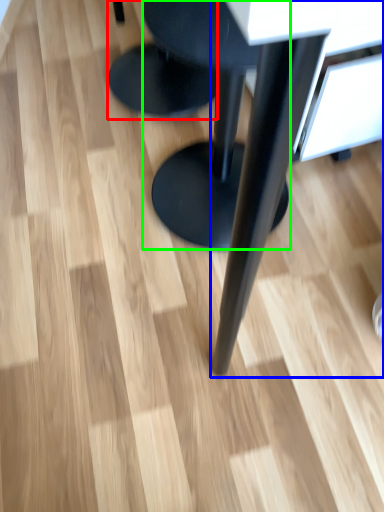
Question: Which object is the farthest from stool (highlighted by a red box)? Choose among these: table (highlighted by a blue box) or stool (highlighted by a green box).

Choices:
 (A) table
 (B) stool

Answer: (A)